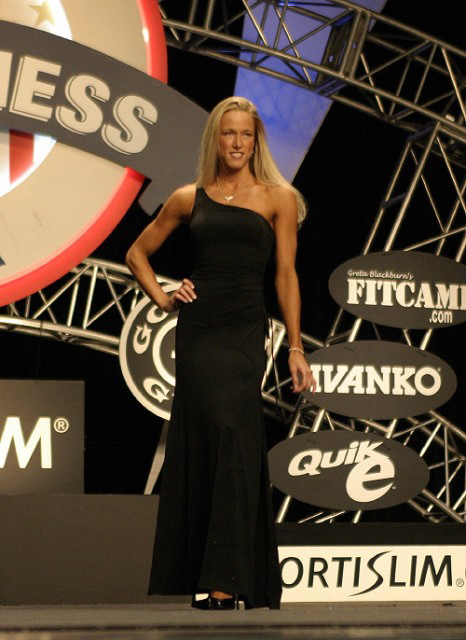
Locate an element on the screen. This screenshot has width=466, height=640. black wall is located at coordinates (109, 416), (349, 146), (200, 67), (451, 0).